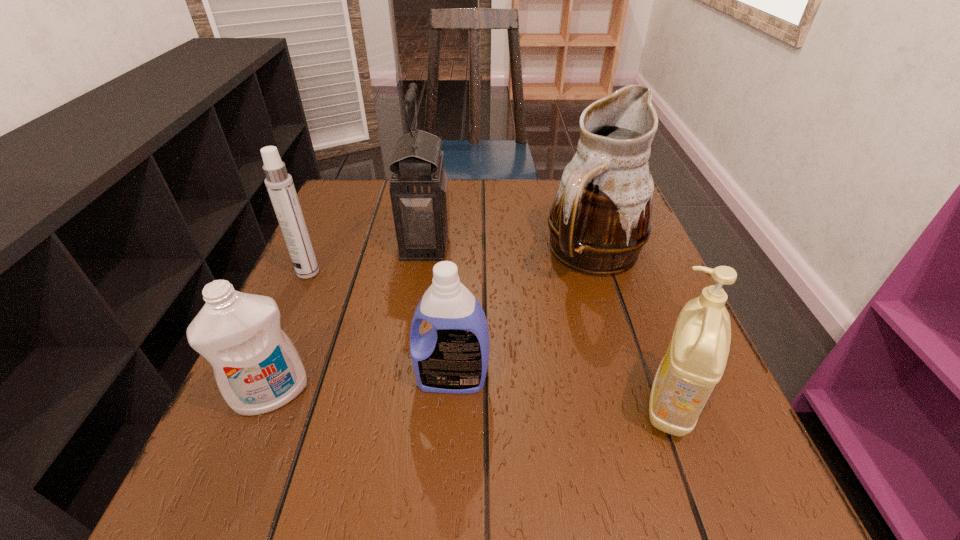
This screenshot has height=540, width=960. I want to click on vacant space at the near edge, so click(x=358, y=515).

In the image, there is a desktop. In order to click on vacant area at the left edge in this screenshot , I will do `click(354, 313)`.

Locate an element on the screen. vacant region at the near left corner is located at coordinates (281, 467).

What are the coordinates of `vacant area that lies between the lantern and the rightmost detergent` in the screenshot? It's located at (548, 323).

Find the location of a particular element. This screenshot has width=960, height=540. empty space that is in between the lantern and the rightmost detergent is located at coordinates (548, 323).

The width and height of the screenshot is (960, 540). What are the coordinates of `free spot between the leftmost detergent and the rightmost detergent` in the screenshot? It's located at (471, 399).

Find the location of a particular element. Image resolution: width=960 pixels, height=540 pixels. free space between the pitcher and the rightmost detergent is located at coordinates (633, 328).

Locate an element on the screen. free point between the rightmost detergent and the second detergent from left to right is located at coordinates (562, 392).

Where is `vacant region between the second detergent from left to right and the pitcher`? This screenshot has width=960, height=540. vacant region between the second detergent from left to right and the pitcher is located at coordinates (523, 316).

I want to click on object that is the third closest one to the pitcher, so click(x=452, y=357).